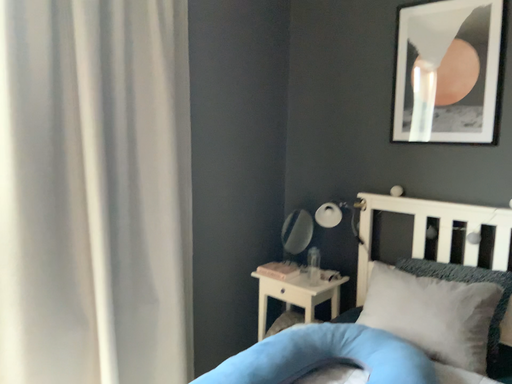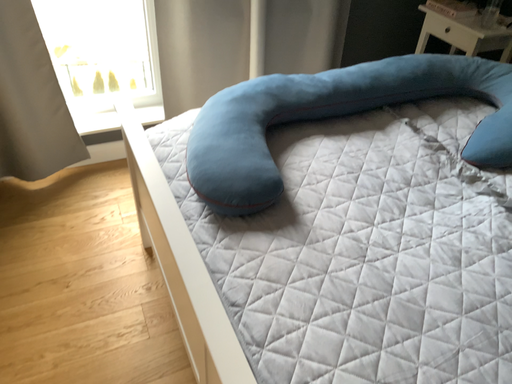
Question: Which way did the camera rotate in the video?

Choices:
 (A) rotated upward
 (B) rotated downward

Answer: (B)